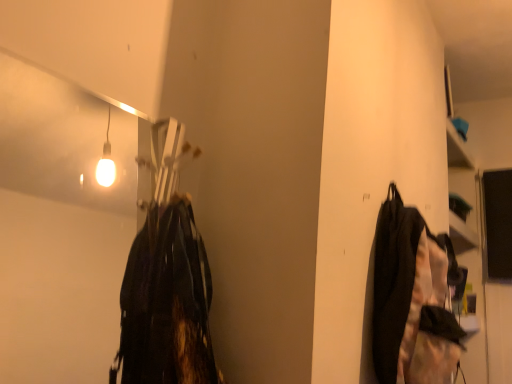
Identify the location of black fabric backpack at right. (411, 296).

The width and height of the screenshot is (512, 384). What do you see at coordinates (411, 296) in the screenshot?
I see `black fabric backpack at right` at bounding box center [411, 296].

What are the coordinates of `black fabric backpack at right` in the screenshot? It's located at pos(411,296).